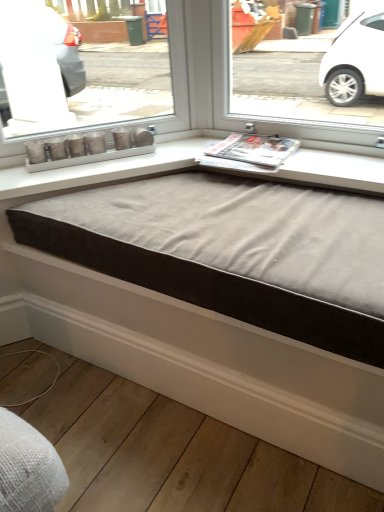
Question: From the image's perspective, is white wood baseboard at lower center located above or below suede-like fabric bed frame at center?

Choices:
 (A) below
 (B) above

Answer: (A)

Question: From a real-world perspective, relative to suede-like fabric bed frame at center, is white wood baseboard at lower center vertically above or below?

Choices:
 (A) above
 (B) below

Answer: (B)

Question: Based on their relative distances, which object is nearer to the suede-like fabric bed frame at center?

Choices:
 (A) matte silver candlesticks at center
 (B) white wood baseboard at lower center
 (C) printed glossy magazine at center

Answer: (B)

Question: Which object is positioned closest to the suede-like fabric bed frame at center?

Choices:
 (A) matte silver candlesticks at center
 (B) white wood baseboard at lower center
 (C) printed glossy magazine at center

Answer: (B)